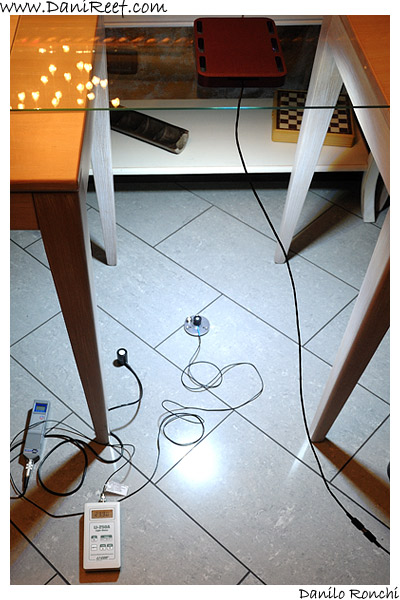
Where is `cords`? Image resolution: width=400 pixels, height=600 pixels. cords is located at coordinates (199, 428), (136, 400), (299, 343), (60, 442), (64, 423).